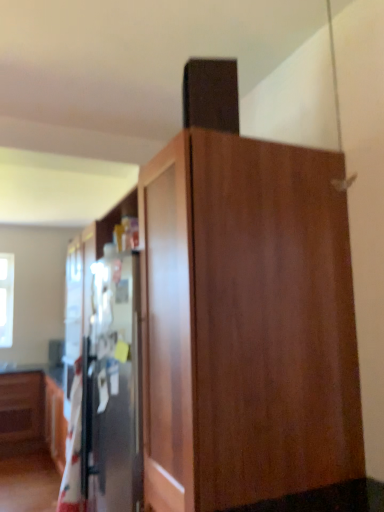
Question: From a real-world perspective, is transparent glass window at upper left beneath wooden cabinet at center?

Choices:
 (A) yes
 (B) no

Answer: (B)

Question: Is wooden cabinet at center surrounded by transparent glass window at upper left?

Choices:
 (A) no
 (B) yes

Answer: (A)

Question: Considering the relative sizes of transparent glass window at upper left and wooden cabinet at center in the image provided, is transparent glass window at upper left taller than wooden cabinet at center?

Choices:
 (A) yes
 (B) no

Answer: (B)

Question: Is transparent glass window at upper left thinner than wooden cabinet at center?

Choices:
 (A) yes
 (B) no

Answer: (A)

Question: From a real-world perspective, is transparent glass window at upper left on top of wooden cabinet at center?

Choices:
 (A) no
 (B) yes

Answer: (B)

Question: Does transparent glass window at upper left appear on the right side of wooden cabinet at center?

Choices:
 (A) yes
 (B) no

Answer: (B)

Question: Considering the relative sizes of white cotton blanket at left and wooden cabinet at center in the image provided, is white cotton blanket at left thinner than wooden cabinet at center?

Choices:
 (A) yes
 (B) no

Answer: (A)

Question: Does white cotton blanket at left appear on the right side of wooden cabinet at center?

Choices:
 (A) no
 (B) yes

Answer: (A)

Question: Is white cotton blanket at left bigger than wooden cabinet at center?

Choices:
 (A) yes
 (B) no

Answer: (B)

Question: Is the depth of white cotton blanket at left less than that of wooden cabinet at center?

Choices:
 (A) no
 (B) yes

Answer: (A)

Question: Can you confirm if white cotton blanket at left is wider than wooden cabinet at center?

Choices:
 (A) no
 (B) yes

Answer: (A)

Question: From the image's perspective, is white cotton blanket at left beneath wooden cabinet at center?

Choices:
 (A) no
 (B) yes

Answer: (B)

Question: Is wooden cabinet at center aimed at white cotton blanket at left?

Choices:
 (A) yes
 (B) no

Answer: (A)